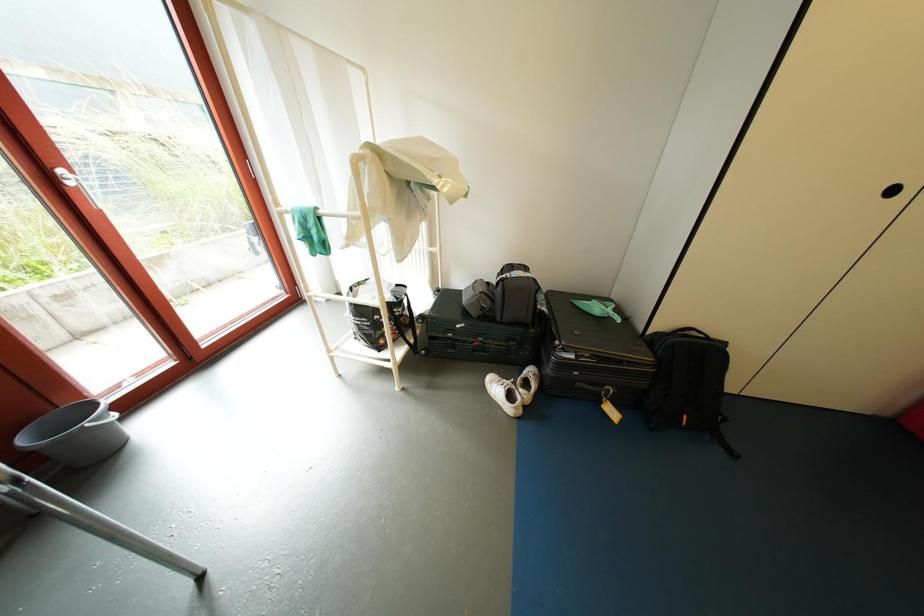
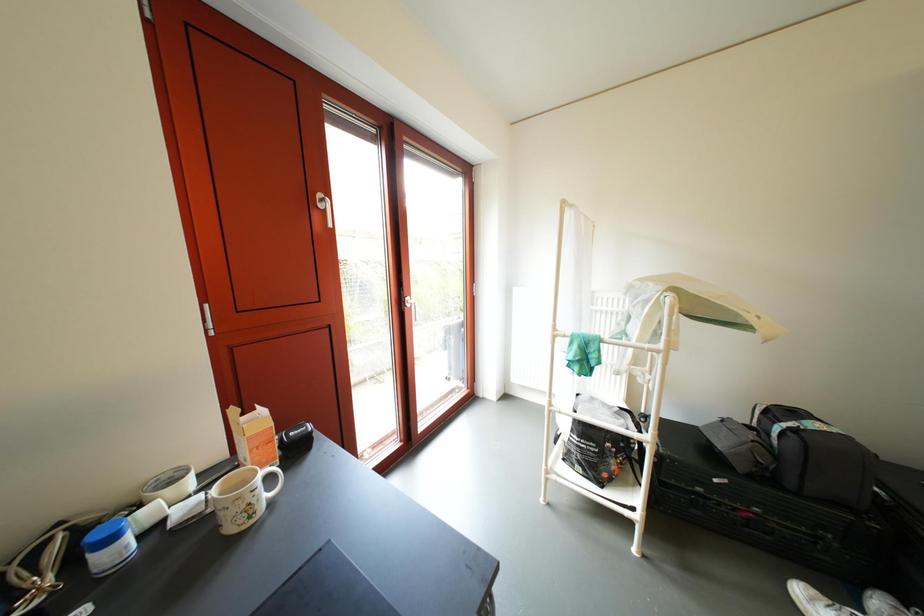
The images are taken continuously from a first-person perspective. In which direction is your viewpoint rotating?

The camera's rotation is toward left-up.